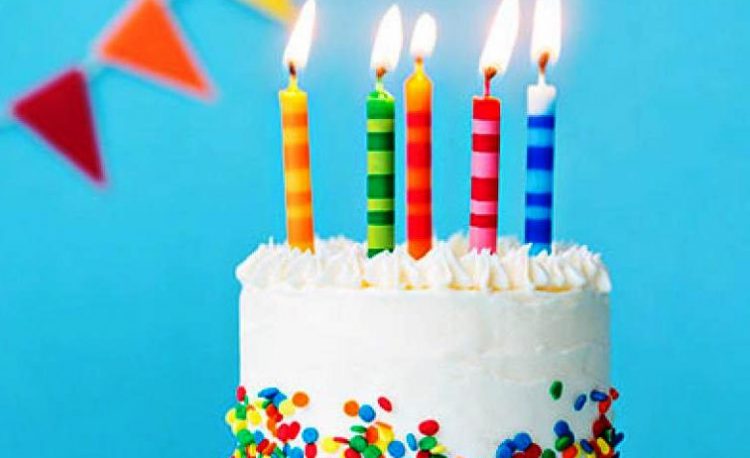
You are a GUI agent. You are given a task and a screenshot of the screen. Output one action in this format:
    pyautogui.click(x=<x>, y=<y>)
    Task: Click on the birthday candles
    This screenshot has width=750, height=458.
    Given the screenshot: What is the action you would take?
    pyautogui.click(x=298, y=160), pyautogui.click(x=384, y=157), pyautogui.click(x=420, y=151), pyautogui.click(x=486, y=162), pyautogui.click(x=538, y=182)